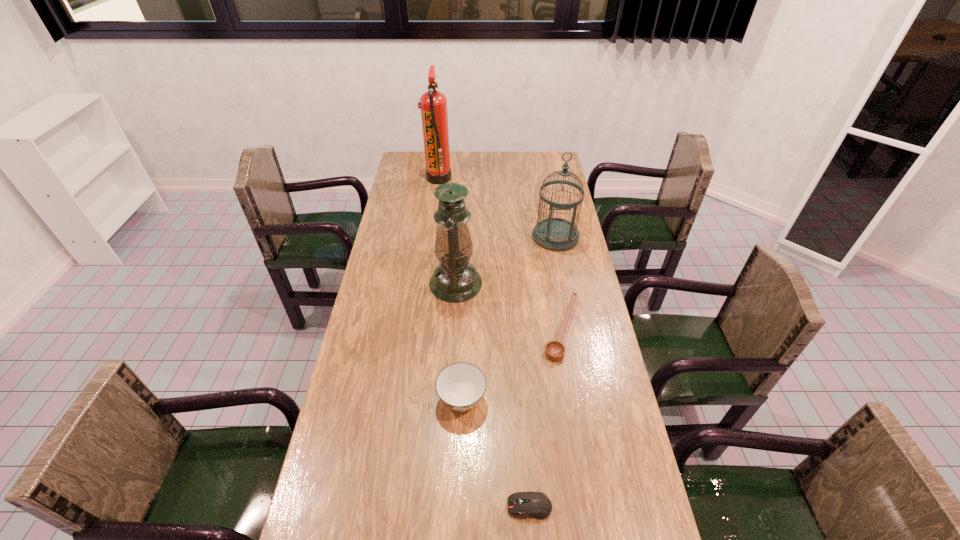
Where is `object positioned at the far left corner`? The width and height of the screenshot is (960, 540). object positioned at the far left corner is located at coordinates (433, 104).

What are the coordinates of `free space at the left edge` in the screenshot? It's located at (418, 218).

The image size is (960, 540). In order to click on free location at the right edge of the desktop in this screenshot , I will do `click(574, 288)`.

You are a GUI agent. You are given a task and a screenshot of the screen. Output one action in this format:
    pyautogui.click(x=<x>, y=<y>)
    Task: Click on the vacant space at the far left corner
    Image resolution: width=960 pixels, height=540 pixels.
    Given the screenshot: What is the action you would take?
    pyautogui.click(x=420, y=174)

Locate an element on the screen. This screenshot has height=540, width=960. free region at the far right corner of the desktop is located at coordinates (536, 177).

I want to click on free space between the second farthest object and the nearest object, so click(x=542, y=372).

The height and width of the screenshot is (540, 960). I want to click on empty space that is in between the wooden spoon and the birdcage, so click(559, 283).

You are a GUI agent. You are given a task and a screenshot of the screen. Output one action in this format:
    pyautogui.click(x=<x>, y=<y>)
    Task: Click on the free spot between the soup bowl and the third object from right to left
    This screenshot has height=540, width=960.
    Given the screenshot: What is the action you would take?
    pyautogui.click(x=495, y=453)

The width and height of the screenshot is (960, 540). I want to click on free space between the fire extinguisher and the computer equipment, so click(x=484, y=342).

Identify the location of free space between the wooden spoon and the fifth nearest object. Image resolution: width=960 pixels, height=540 pixels. (559, 283).